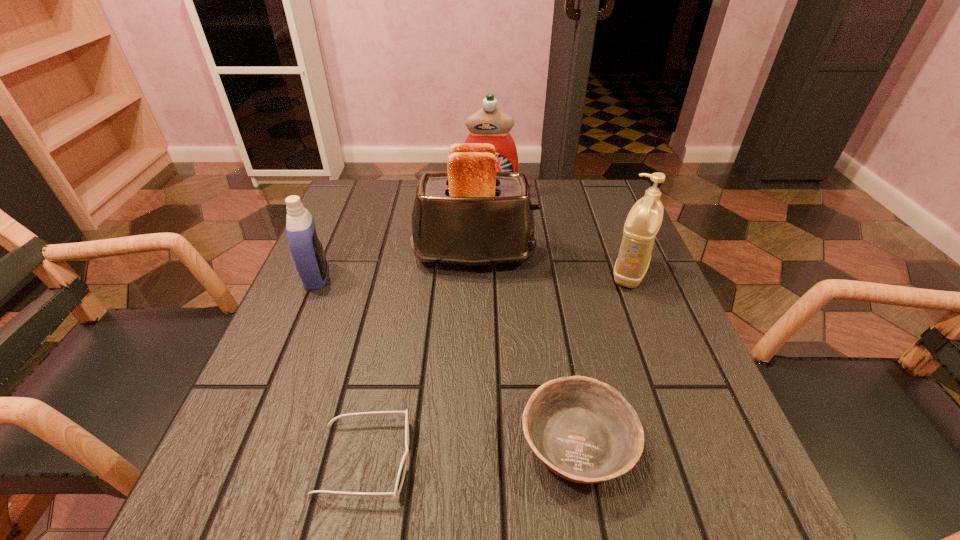
Identify which detergent is the nearest to the rightmost detergent. Please provide its 2D coordinates. Your answer should be formatted as a tuple, i.e. [(x, y)], where the tuple contains the x and y coordinates of a point satisfying the conditions above.

[(491, 125)]

Locate which detergent ranks second in proximity to the farthest object. Please provide its 2D coordinates. Your answer should be formatted as a tuple, i.e. [(x, y)], where the tuple contains the x and y coordinates of a point satisfying the conditions above.

[(306, 248)]

Locate an element on the screen. vacant region that satisfies the following two spatial constraints: 1. on the side of the rightmost detergent with the control lever; 2. on the left side of the toaster is located at coordinates (474, 273).

Where is `free spot that satisfies the following two spatial constraints: 1. on the front surface of the tallest detergent; 2. with the lenses of the sunglasses facing outward`? free spot that satisfies the following two spatial constraints: 1. on the front surface of the tallest detergent; 2. with the lenses of the sunglasses facing outward is located at coordinates (496, 460).

You are a GUI agent. You are given a task and a screenshot of the screen. Output one action in this format:
    pyautogui.click(x=<x>, y=<y>)
    Task: Click on the free region that satisfies the following two spatial constraints: 1. on the front surface of the farthest object; 2. on the side of the toaster with the control lever
    
    Given the screenshot: What is the action you would take?
    pyautogui.click(x=491, y=255)